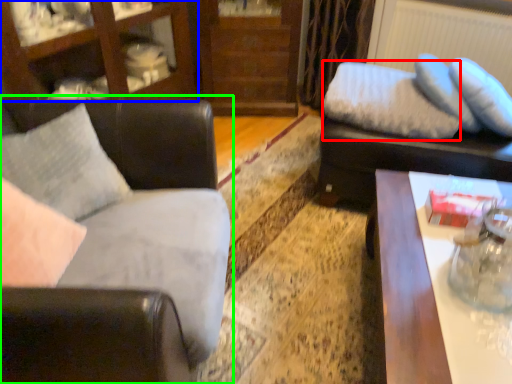
Question: Which object is positioned closest to pillow (highlighted by a red box)? Select from entertainment center (highlighted by a blue box) and studio couch (highlighted by a green box).

Choices:
 (A) entertainment center
 (B) studio couch

Answer: (B)